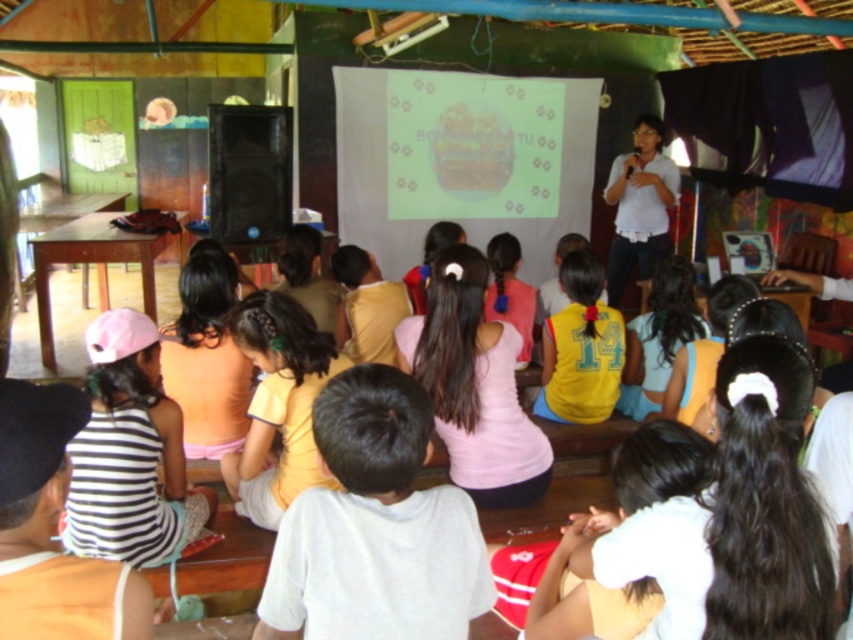
Between white cotton shirt at center and pink matte tank top at center, which one has more height?

With more height is pink matte tank top at center.

This screenshot has width=853, height=640. What do you see at coordinates (375, 528) in the screenshot?
I see `white cotton shirt at center` at bounding box center [375, 528].

Is point (469, 568) in front of point (488, 474)?

Yes, point (469, 568) is in front of point (488, 474).

Where is `white cotton shirt at center`? This screenshot has height=640, width=853. white cotton shirt at center is located at coordinates (375, 528).

Does white cotton shirt at center appear under white matte shirt at upper right?

Correct, white cotton shirt at center is located below white matte shirt at upper right.

Locate an element on the screen. This screenshot has height=640, width=853. white cotton shirt at center is located at coordinates (375, 528).

Which is below, pink matte tank top at center or white matte shirt at upper right?

pink matte tank top at center is below.

Is pink matte tank top at center bigger than white matte shirt at upper right?

No.

Identify the location of pink matte tank top at center. Image resolution: width=853 pixels, height=640 pixels. (474, 385).